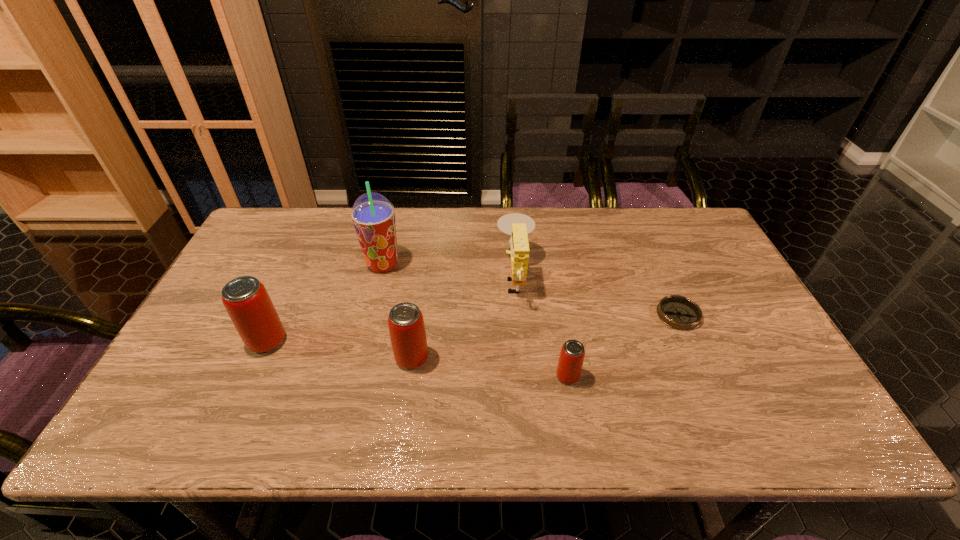
The width and height of the screenshot is (960, 540). Find the location of `object at the right edge`. object at the right edge is located at coordinates (678, 312).

You are a GUI agent. You are given a task and a screenshot of the screen. Output one action in this format:
    pyautogui.click(x=<x>, y=<y>)
    Task: Click on the free space at the far edge of the desktop
    Image resolution: width=960 pixels, height=540 pixels.
    Given the screenshot: What is the action you would take?
    pyautogui.click(x=593, y=238)

In the image, there is a desktop. Identify the location of vacant space at the near edge. (539, 371).

Find the location of a particular element. vacant space at the left edge is located at coordinates (226, 366).

Find the location of a particular element. free space at the right edge of the desktop is located at coordinates (695, 301).

The image size is (960, 540). Find the location of `free space between the smoothie and the leftmost beer can`. free space between the smoothie and the leftmost beer can is located at coordinates (324, 302).

I want to click on vacant area that lies between the leftmost object and the sponge, so click(x=392, y=309).

The height and width of the screenshot is (540, 960). I want to click on free space between the shortest object and the sponge, so click(x=597, y=296).

At what (x,y) coordinates should I click in order to perform the action: click on free space between the sponge and the tallest object. Please return your answer as a coordinate pair (x, y). This screenshot has height=540, width=960. Looking at the image, I should click on (449, 271).

What are the coordinates of `vacant space that's between the second beer can from left to right and the rightmost object` in the screenshot? It's located at (545, 336).